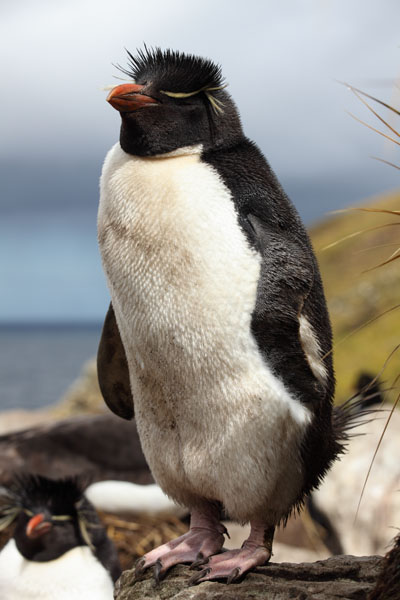
Locate an element on the screen. surface is located at coordinates (263, 589).